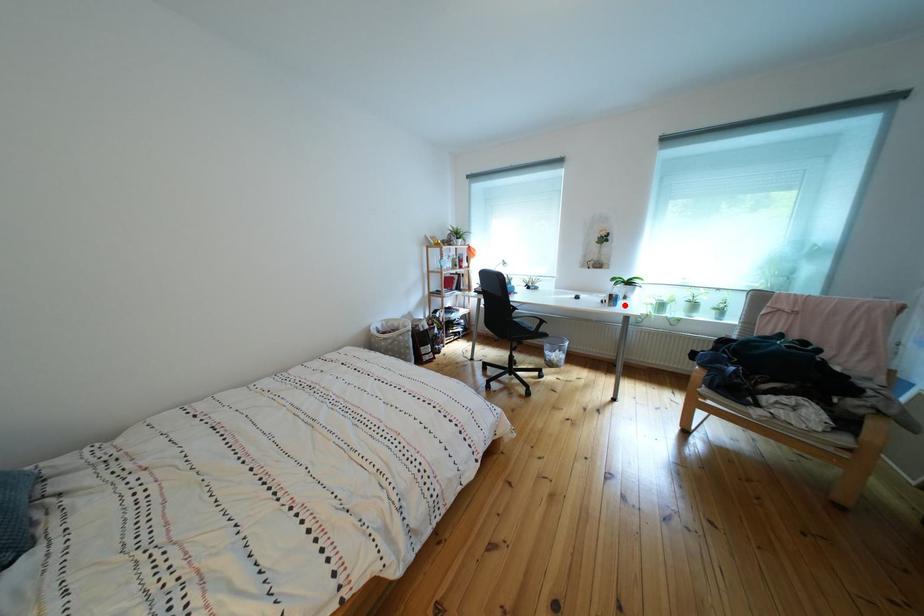
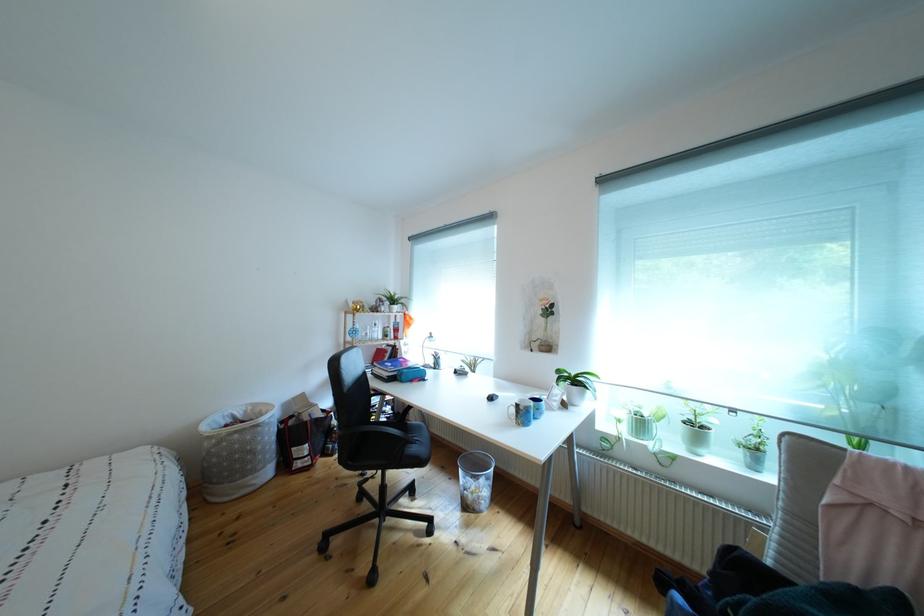
Where in the second image is the point corresponding to the highlighted location from the first image?

(533, 419)